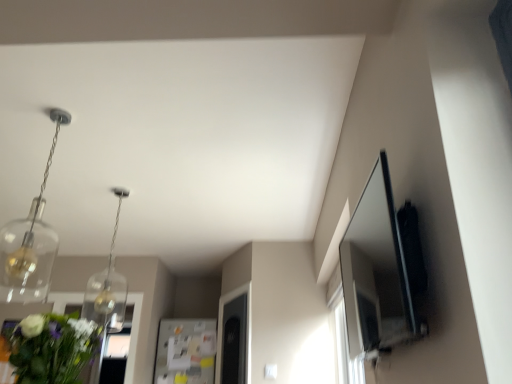
Question: Is green leafy bouquet at lower left shorter than clear glass pendant light at upper left, the 2th light fixture positioned from the front?

Choices:
 (A) no
 (B) yes

Answer: (B)

Question: Can you confirm if green leafy bouquet at lower left is positioned to the left of clear glass pendant light at upper left, the 2th light fixture positioned from the front?

Choices:
 (A) yes
 (B) no

Answer: (B)

Question: Is green leafy bouquet at lower left outside of clear glass pendant light at upper left, marked as the 1th light fixture in a back-to-front arrangement?

Choices:
 (A) yes
 (B) no

Answer: (A)

Question: Is green leafy bouquet at lower left looking in the opposite direction of clear glass pendant light at upper left, the 2th light fixture positioned from the front?

Choices:
 (A) no
 (B) yes

Answer: (A)

Question: Would you say clear glass pendant light at upper left, the 2th light fixture positioned from the front, is part of green leafy bouquet at lower left's contents?

Choices:
 (A) no
 (B) yes

Answer: (A)

Question: Can you confirm if green leafy bouquet at lower left is smaller than clear glass pendant light at upper left, the 2th light fixture positioned from the front?

Choices:
 (A) yes
 (B) no

Answer: (A)

Question: From a real-world perspective, is clear glass pendant at upper left, acting as the second light fixture starting from the back, physically above clear glass pendant light at upper left, marked as the 1th light fixture in a back-to-front arrangement?

Choices:
 (A) no
 (B) yes

Answer: (B)

Question: Is clear glass pendant light at upper left, marked as the 1th light fixture in a back-to-front arrangement, at the back of clear glass pendant at upper left, acting as the second light fixture starting from the back?

Choices:
 (A) yes
 (B) no

Answer: (B)

Question: Does clear glass pendant at upper left, the 1th light fixture viewed from the front, touch clear glass pendant light at upper left, the 2th light fixture positioned from the front?

Choices:
 (A) yes
 (B) no

Answer: (B)

Question: Is clear glass pendant at upper left, the 1th light fixture viewed from the front, facing towards clear glass pendant light at upper left, the 2th light fixture positioned from the front?

Choices:
 (A) yes
 (B) no

Answer: (A)

Question: Considering the relative sizes of clear glass pendant at upper left, acting as the second light fixture starting from the back, and clear glass pendant light at upper left, marked as the 1th light fixture in a back-to-front arrangement, in the image provided, is clear glass pendant at upper left, acting as the second light fixture starting from the back, taller than clear glass pendant light at upper left, marked as the 1th light fixture in a back-to-front arrangement,?

Choices:
 (A) yes
 (B) no

Answer: (B)

Question: Is clear glass pendant at upper left, acting as the second light fixture starting from the back, not inside clear glass pendant light at upper left, the 2th light fixture positioned from the front?

Choices:
 (A) yes
 (B) no

Answer: (A)

Question: Does clear glass pendant light at upper left, the 2th light fixture positioned from the front, turn towards clear glass pendant at upper left, acting as the second light fixture starting from the back?

Choices:
 (A) no
 (B) yes

Answer: (B)